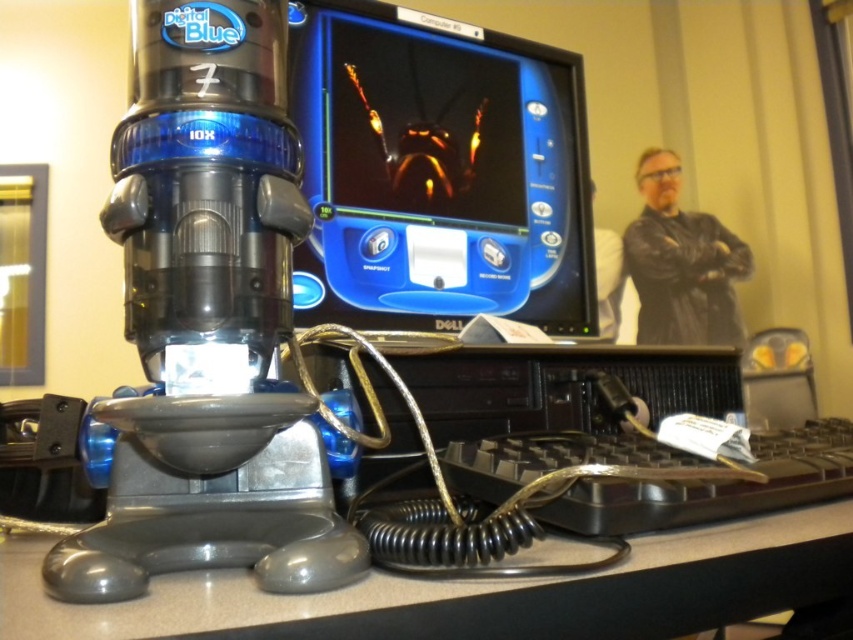
You are a researcher in a lab and need to locate the metallic gray microscope at center. According to the coordinates provided, where exactly is it positioned in the image?

The metallic gray microscope at center is located at point coordinates of (207,321).

You are standing in the workspace and want to place a heavy object on the closest surface to you. Which object between the gray plastic table at lower center and the black leather jacket at upper right can you use?

The gray plastic table at lower center is closer to the viewer than the black leather jacket at upper right, so you can place the heavy object on the gray plastic table at lower center.

Please describe the object located at the coordinates point [207,321] in the image.

The object at point [207,321] is a metallic gray microscope at center.